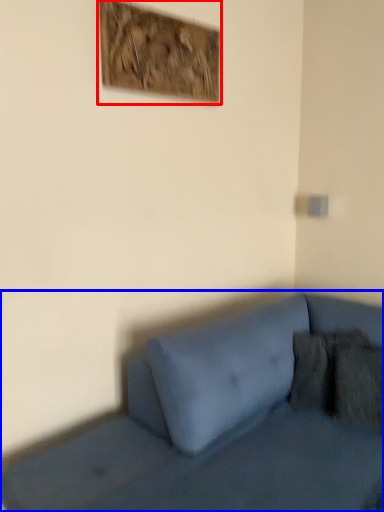
Question: Among these objects, which one is farthest to the camera, picture frame (highlighted by a red box) or studio couch (highlighted by a blue box)?

Choices:
 (A) picture frame
 (B) studio couch

Answer: (A)